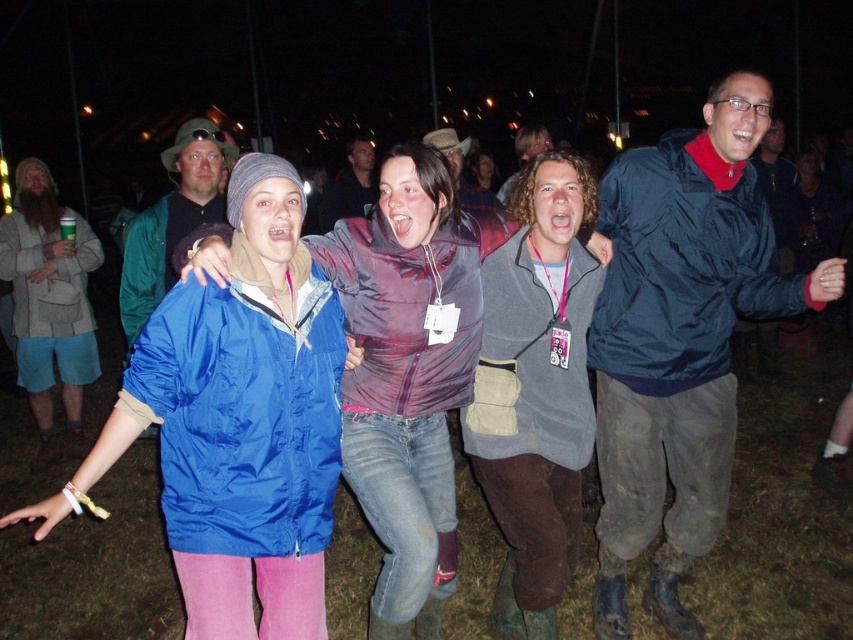
Question: Which object is the farthest from the matte blue jacket at center?

Choices:
 (A) matte purple jacket at center
 (B) matte green jacket at center
 (C) dark blue jacket at center
 (D) gray woolen sweater at center

Answer: (A)

Question: Can you confirm if matte purple shirt at center is positioned to the right of gray woolen sweater at center?

Choices:
 (A) no
 (B) yes

Answer: (A)

Question: Which object is positioned closest to the matte purple shirt at center?

Choices:
 (A) dark blue jacket at center
 (B) matte green jacket at center
 (C) matte purple jacket at center

Answer: (C)

Question: Can you confirm if blue nylon jacket at center is positioned above beige textured jacket at left?

Choices:
 (A) yes
 (B) no

Answer: (B)

Question: Does matte blue jacket at center have a larger size compared to blue nylon jacket at center?

Choices:
 (A) no
 (B) yes

Answer: (A)

Question: Which point appears farthest from the camera in this image?

Choices:
 (A) (718, 202)
 (B) (50, 196)

Answer: (B)